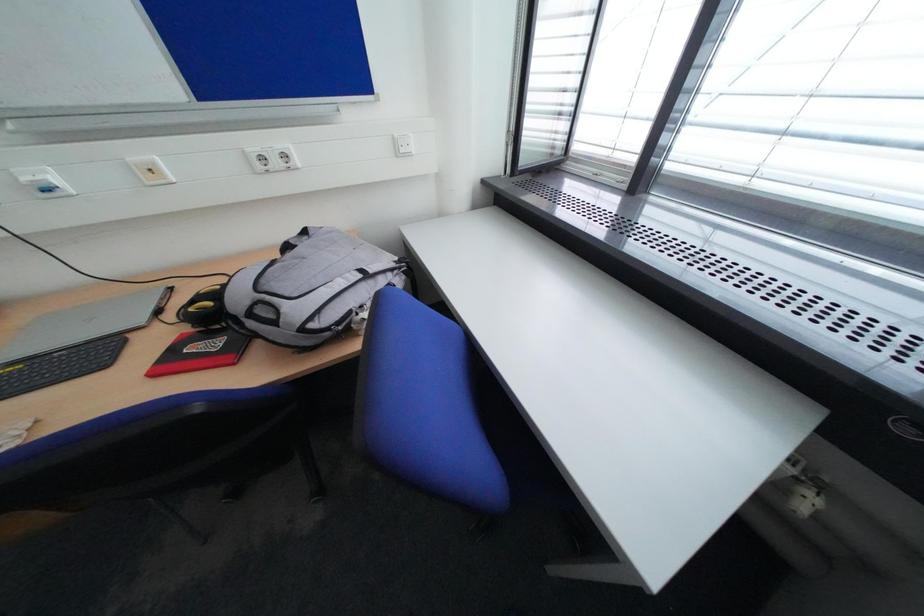
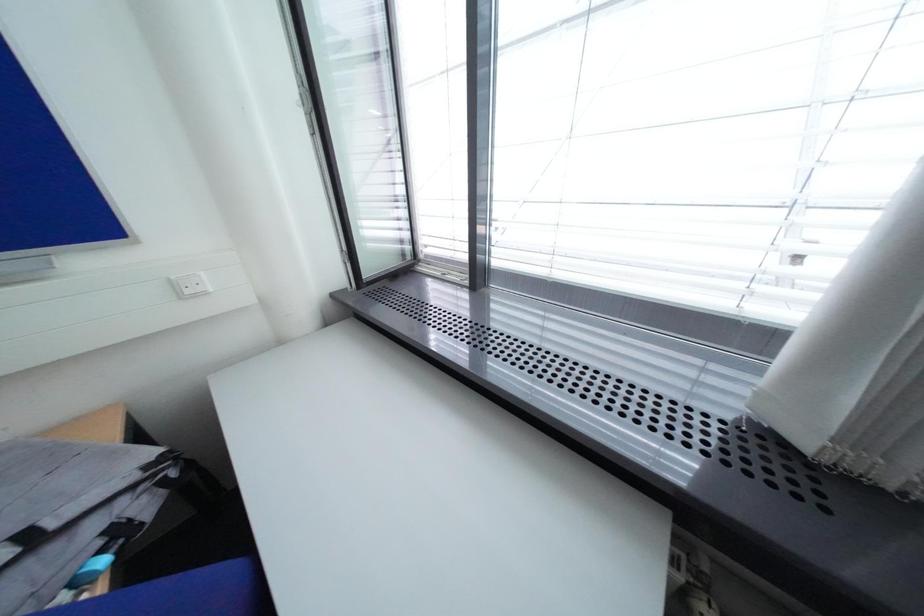
Question: The images are taken continuously from a first-person perspective. In which direction is your viewpoint rotating?

Choices:
 (A) Left
 (B) Right
 (C) Up
 (D) Down

Answer: (B)